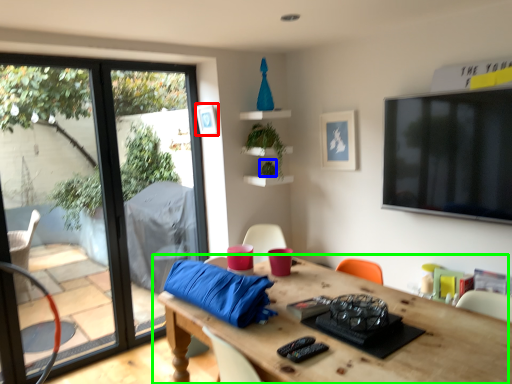
Question: Estimate the real-world distances between objects in this image. Which object is farther from picture frame (highlighted by a red box), plant (highlighted by a blue box) or table (highlighted by a green box)?

Choices:
 (A) plant
 (B) table

Answer: (B)